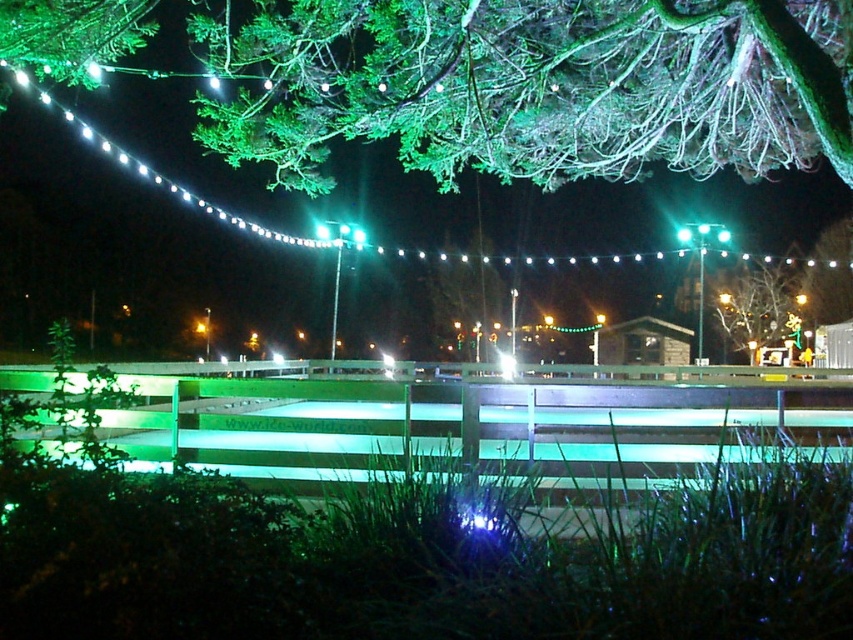
The image size is (853, 640). Describe the element at coordinates (534, 84) in the screenshot. I see `green leafy branches at upper center` at that location.

Is green leafy branches at upper center above green matte tree at upper center?

Correct, green leafy branches at upper center is located above green matte tree at upper center.

Locate an element on the screen. The width and height of the screenshot is (853, 640). green leafy branches at upper center is located at coordinates (534, 84).